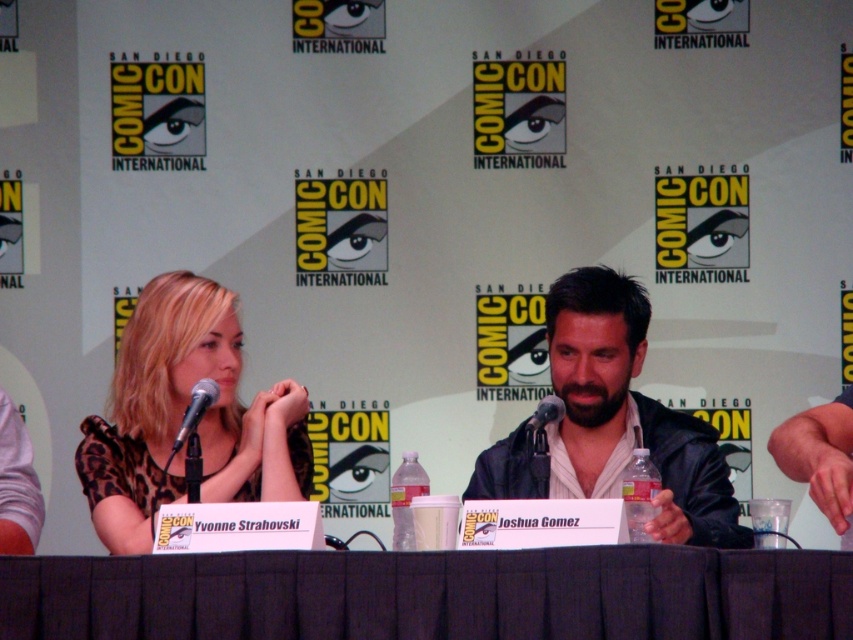
You are attending the panel discussion at Comic Con and want to know which of the two points, point [701,600] or point [548,412], is closer to you. Can you determine this based on the image?

Point [701,600] is closer to the viewer than point [548,412].

You are attending a panel discussion at ComicCon and want to know the spatial relationship between two points on the stage. The first point is labeled as point [606,278] and the second is point [209,406]. From your perspective as an attendee sitting in the audience, which point is located further back on the stage?

Point [606,278] is behind point [209,406], so from the audience perspective, point [606,278] is further back on the stage.

You are a photographer at the event and need to capture a closeup shot of both the silver metallic microphone at center and the black plastic microphone at center. The camera you are using has a maximum focus range of 30 inches. Can you photograph both microphones in a single shot without moving the camera?

The silver metallic microphone at center is 33.36 inches away from the black plastic microphone at center, which exceeds the camera maximum focus range of 30 inches. Therefore, you cannot photograph both microphones in a single shot without moving the camera.